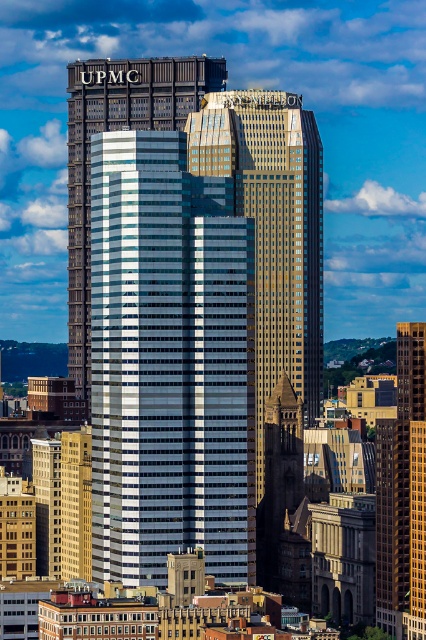
Question: Does gold reflective glass skyscraper at center appear on the right side of gold glass skyscraper at center?

Choices:
 (A) yes
 (B) no

Answer: (B)

Question: Which is farther from the gold glass skyscraper at center?

Choices:
 (A) metallic glass skyscraper at center
 (B) white glass skyscraper at center
 (C) gold reflective glass skyscraper at center

Answer: (B)

Question: Is metallic glass skyscraper at center in front of gold reflective glass skyscraper at center?

Choices:
 (A) yes
 (B) no

Answer: (A)

Question: Which object is farther from the camera taking this photo?

Choices:
 (A) metallic glass skyscraper at center
 (B) gold glass skyscraper at center
 (C) white glass skyscraper at center
 (D) gold reflective glass skyscraper at center

Answer: (B)

Question: Is metallic glass skyscraper at center thinner than gold reflective glass skyscraper at center?

Choices:
 (A) yes
 (B) no

Answer: (B)

Question: Which point is farther to the camera?

Choices:
 (A) gold glass skyscraper at center
 (B) metallic glass skyscraper at center
 (C) white glass skyscraper at center
 (D) gold reflective glass skyscraper at center

Answer: (A)